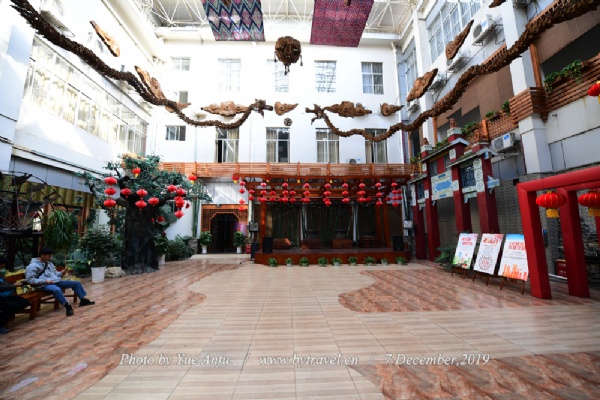
Where is `archway`? The image size is (600, 400). archway is located at coordinates (216, 226).